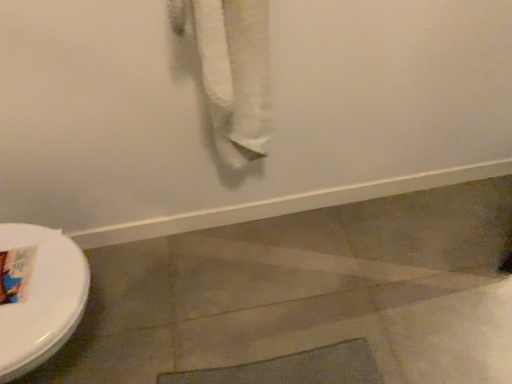
The image size is (512, 384). In order to click on white glossy toilet at left in this screenshot , I will do `click(38, 295)`.

This screenshot has width=512, height=384. Describe the element at coordinates (38, 295) in the screenshot. I see `white glossy toilet at left` at that location.

In order to click on white cotton towel at upper center in this screenshot , I will do 231,70.

Describe the element at coordinates (231, 70) in the screenshot. I see `white cotton towel at upper center` at that location.

Find the location of a particular element. The height and width of the screenshot is (384, 512). white glossy toilet at left is located at coordinates (38, 295).

Considering the relative positions of white cotton towel at upper center and white glossy toilet at left in the image provided, is white cotton towel at upper center to the right of white glossy toilet at left from the viewer's perspective?

Yes, white cotton towel at upper center is to the right of white glossy toilet at left.

Considering the relative positions of white cotton towel at upper center and white glossy toilet at left in the image provided, is white cotton towel at upper center in front of white glossy toilet at left?

Yes, it is.

Between point (253, 115) and point (50, 349), which one is positioned in front?

Point (50, 349)

Consider the image. From the image's perspective, which is above, white cotton towel at upper center or white glossy toilet at left?

white cotton towel at upper center is shown above in the image.

From a real-world perspective, is white cotton towel at upper center beneath white glossy toilet at left?

No, from a real-world perspective, white cotton towel at upper center is not beneath white glossy toilet at left.

Looking at this image, considering the sizes of objects white cotton towel at upper center and white glossy toilet at left in the image provided, who is wider, white cotton towel at upper center or white glossy toilet at left?

white glossy toilet at left.

Can you confirm if white cotton towel at upper center is taller than white glossy toilet at left?

Correct, white cotton towel at upper center is much taller as white glossy toilet at left.

Who is bigger, white cotton towel at upper center or white glossy toilet at left?

Bigger between the two is white glossy toilet at left.

Is white cotton towel at upper center spatially inside white glossy toilet at left, or outside of it?

white cotton towel at upper center is not inside white glossy toilet at left, it's outside.

Is white cotton towel at upper center not close to white glossy toilet at left?

That's not correct — white cotton towel at upper center is a little close to white glossy toilet at left.

Does white cotton towel at upper center turn towards white glossy toilet at left?

No, white cotton towel at upper center is not turned towards white glossy toilet at left.

How different are the orientations of white cotton towel at upper center and white glossy toilet at left in degrees?

The facing directions of white cotton towel at upper center and white glossy toilet at left are 88.6 degrees apart.

This screenshot has height=384, width=512. I want to click on bath towel above the white glossy toilet at left (from a real-world perspective), so click(x=231, y=70).

Based on their positions, is white glossy toilet at left located to the left or right of white cotton towel at upper center?

In the image, white glossy toilet at left appears on the left side of white cotton towel at upper center.

Does white glossy toilet at left lie in front of white cotton towel at upper center?

No, white glossy toilet at left is behind white cotton towel at upper center.

Between point (32, 245) and point (198, 5), which one is positioned in front?

The point (198, 5) is closer.

From the image's perspective, which object appears higher, white glossy toilet at left or white cotton towel at upper center?

white cotton towel at upper center, from the image's perspective.

From a real-world perspective, is white glossy toilet at left positioned above or below white cotton towel at upper center?

Clearly, from a real-world perspective, white glossy toilet at left is below white cotton towel at upper center.

Is white glossy toilet at left thinner than white cotton towel at upper center?

No, white glossy toilet at left is not thinner than white cotton towel at upper center.

Considering the sizes of objects white glossy toilet at left and white cotton towel at upper center in the image provided, who is taller, white glossy toilet at left or white cotton towel at upper center?

Standing taller between the two is white cotton towel at upper center.

Who is smaller, white glossy toilet at left or white cotton towel at upper center?

white cotton towel at upper center is smaller.

Is white cotton towel at upper center a part of white glossy toilet at left?

No, white cotton towel at upper center is not inside white glossy toilet at left.

Are white glossy toilet at left and white cotton towel at upper center far apart?

No, white glossy toilet at left is not far from white cotton towel at upper center.

Could you tell me if white glossy toilet at left is turned towards white cotton towel at upper center?

No, white glossy toilet at left is not turned towards white cotton towel at upper center.

What's the angular difference between white glossy toilet at left and white cotton towel at upper center's facing directions?

The angle between the facing direction of white glossy toilet at left and the facing direction of white cotton towel at upper center is 88.6 degrees.

The image size is (512, 384). In order to click on bath towel on the right side of white glossy toilet at left in this screenshot , I will do `click(231, 70)`.

This screenshot has height=384, width=512. Find the location of `bath towel located on the right of white glossy toilet at left`. bath towel located on the right of white glossy toilet at left is located at coordinates (231, 70).

I want to click on toilet below the white cotton towel at upper center (from a real-world perspective), so click(38, 295).